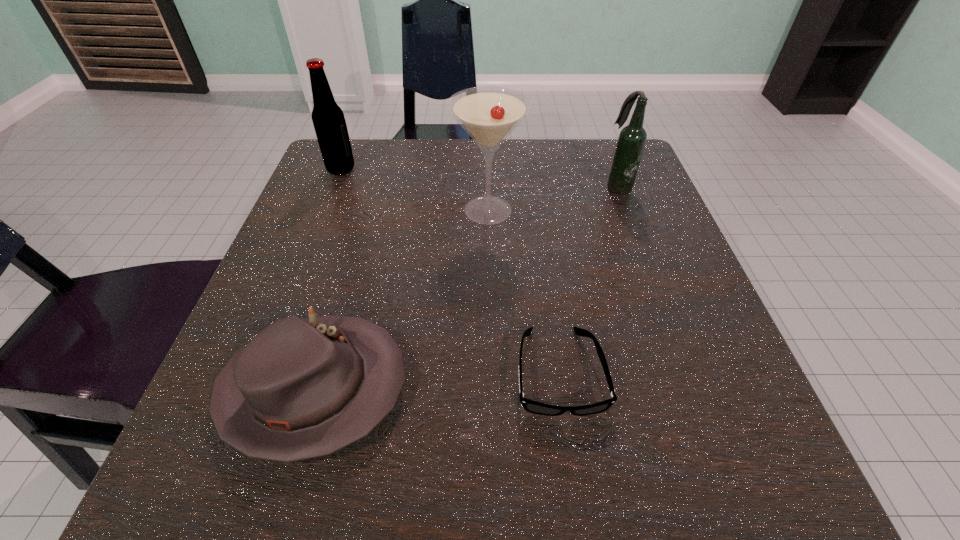
The width and height of the screenshot is (960, 540). In order to click on vacant region located 0.350m on the decorative side of the fourth tallest object in this screenshot , I will do `click(660, 389)`.

The image size is (960, 540). What are the coordinates of `vacant region located on the front-facing side of the sunglasses` in the screenshot? It's located at (576, 495).

Identify the location of martini positioned at the far edge. (489, 114).

At what (x,y) coordinates should I click in order to perform the action: click on object located in the near edge section of the desktop. Please return your answer as a coordinate pair (x, y). This screenshot has width=960, height=540. Looking at the image, I should click on (306, 388).

Locate an element on the screen. beer bottle present at the left edge is located at coordinates (328, 119).

I want to click on hat positioned at the left edge, so click(x=306, y=388).

Where is `object at the right edge`? object at the right edge is located at coordinates (631, 141).

You are a GUI agent. You are given a task and a screenshot of the screen. Output one action in this format:
    pyautogui.click(x=<x>, y=<y>)
    Task: Click on the object that is positioned at the far left corner
    The width and height of the screenshot is (960, 540).
    Given the screenshot: What is the action you would take?
    pyautogui.click(x=328, y=119)

The height and width of the screenshot is (540, 960). What are the coordinates of `object located in the near left corner section of the desktop` in the screenshot? It's located at (306, 388).

The image size is (960, 540). Identify the location of object that is positioned at the far right corner. (631, 141).